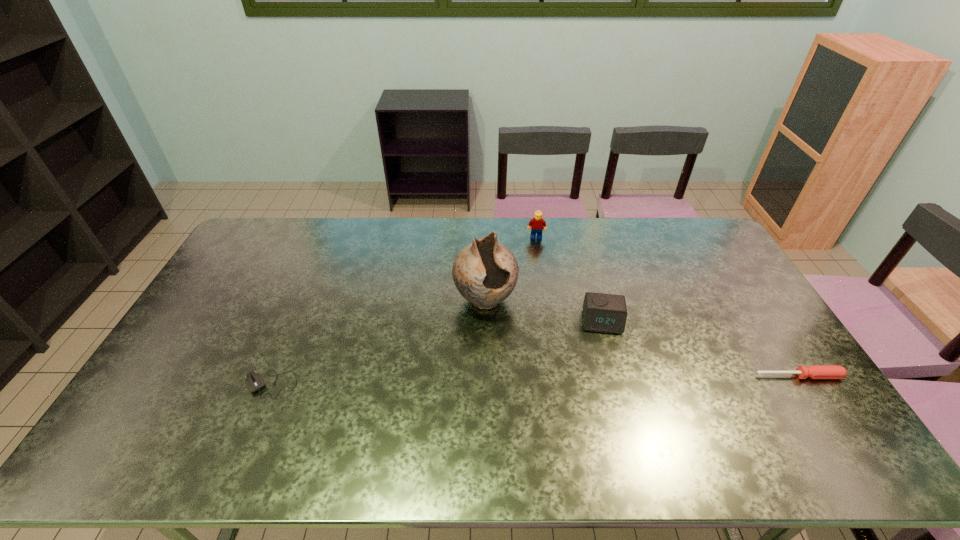
Where is `vacant space located on the front-facing side of the third tallest object`? vacant space located on the front-facing side of the third tallest object is located at coordinates (606, 358).

Find the location of `object that is at the far edge`. object that is at the far edge is located at coordinates (536, 224).

The image size is (960, 540). I want to click on object present at the near edge, so click(254, 381).

Identify the location of object situated at the right edge. This screenshot has width=960, height=540. (813, 371).

At what (x,y) coordinates should I click in order to perform the action: click on free location at the far edge of the desktop. Please return your answer as a coordinate pair (x, y). Looking at the image, I should click on (424, 231).

Where is `vacant space at the near edge of the desktop`? This screenshot has height=540, width=960. vacant space at the near edge of the desktop is located at coordinates (541, 422).

The height and width of the screenshot is (540, 960). What are the coordinates of `free point at the left edge` in the screenshot? It's located at (207, 333).

Where is `vacant area at the right edge of the desktop`? This screenshot has width=960, height=540. vacant area at the right edge of the desktop is located at coordinates (730, 293).

Image resolution: width=960 pixels, height=540 pixels. In the image, there is a desktop. Identify the location of vacant space at the far left corner. (257, 235).

In the image, there is a desktop. Where is `vacant space at the near right corner`? vacant space at the near right corner is located at coordinates (817, 411).